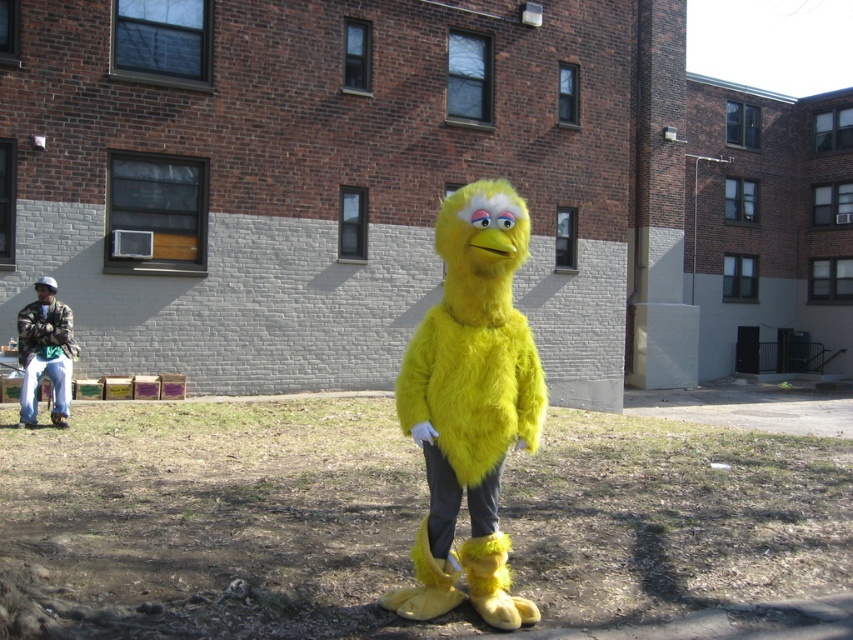
You are a delivery robot with a 2 meter long package. You need to move from the fluffy yellow bird at center to the camo fabric jacket at left. Can you fit the package between them without tilting it?

The distance between the fluffy yellow bird at center and the camo fabric jacket at left is 7.23 meters, which is more than enough to accommodate a 2 meter long package without tilting it.